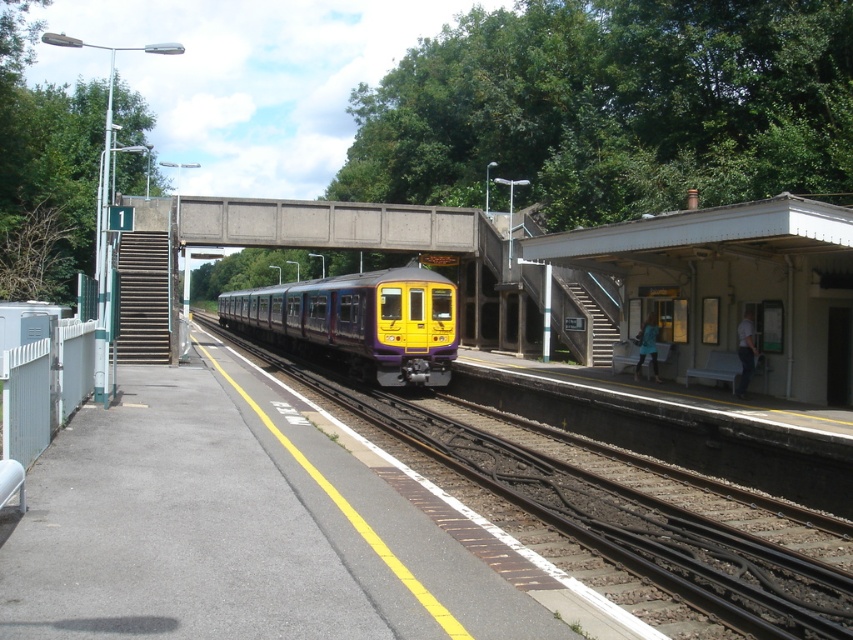
Who is higher up, yellow matte train at center or concrete at center?

concrete at center

Does yellow matte train at center have a lesser width compared to concrete at center?

No.

Which is in front, point (230, 314) or point (213, 243)?

Point (213, 243) is more forward.

Locate an element on the screen. The image size is (853, 640). yellow matte train at center is located at coordinates click(x=358, y=321).

How distant is purple/yellow train at center from concrete at center?

purple/yellow train at center and concrete at center are 10.96 meters apart from each other.

Who is more forward, (674, 577) or (419, 248)?

Point (674, 577) is more forward.

What are the coordinates of `purple/yellow train at center` in the screenshot? It's located at (616, 518).

Can you confirm if purple/yellow train at center is positioned below yellow matte train at center?

Yes, purple/yellow train at center is below yellow matte train at center.

Is purple/yellow train at center taller than yellow matte train at center?

No, purple/yellow train at center is not taller than yellow matte train at center.

Locate an element on the screen. This screenshot has width=853, height=640. purple/yellow train at center is located at coordinates (616, 518).

Locate an element on the screen. purple/yellow train at center is located at coordinates (616, 518).